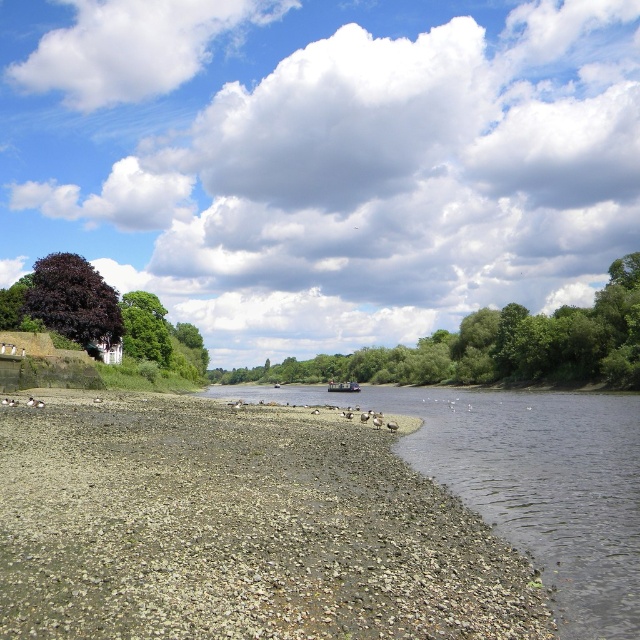
Question: Among these objects, which one is nearest to the camera?

Choices:
 (A) gray gravel shore at lower left
 (B) metallic gray boat at center
 (C) green leafy tree at center

Answer: (A)

Question: Which of the following is the closest to the observer?

Choices:
 (A) metallic gray boat at center
 (B) gray gravel shore at lower left
 (C) purple-leaved tree at upper left
 (D) green leafy tree at center

Answer: (B)

Question: Among these objects, which one is farthest from the camera?

Choices:
 (A) metallic gray boat at center
 (B) green leafy tree at center
 (C) gray gravel shore at lower left
 (D) purple-leaved tree at upper left

Answer: (A)

Question: Is gray gravel shore at lower left to the right of metallic gray boat at center from the viewer's perspective?

Choices:
 (A) no
 (B) yes

Answer: (A)

Question: Is gray gravel shore at lower left thinner than purple-leaved tree at upper left?

Choices:
 (A) no
 (B) yes

Answer: (A)

Question: Is gray gravel shore at lower left thinner than metallic gray boat at center?

Choices:
 (A) no
 (B) yes

Answer: (A)